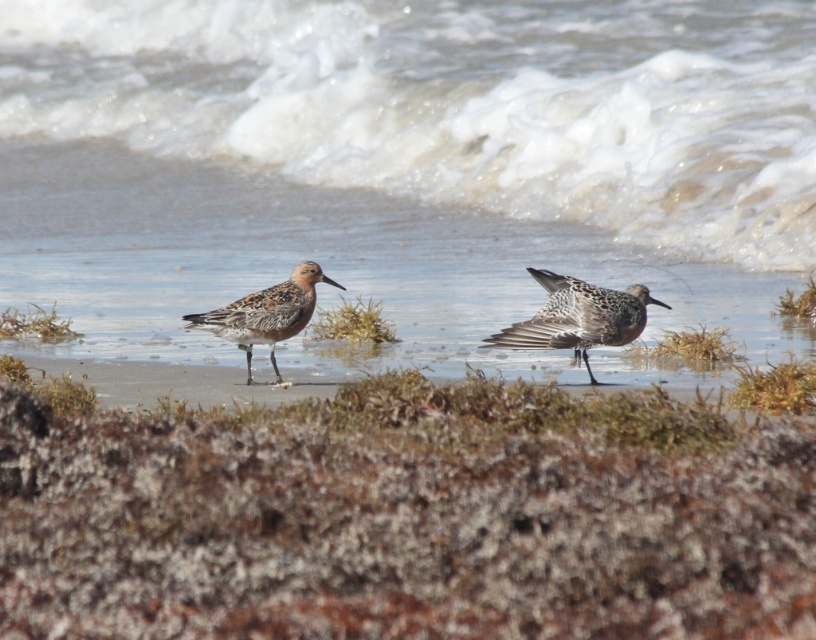
You are a birdwatcher standing on the shore observing the two birds. You notice the white frothy water at center and the brown speckled feathers at center. How far apart are these two features from each other?

The white frothy water at center is 6.60 meters from the brown speckled feathers at center.

You are a birdwatcher observing the two birds in the scene. You notice that one has brown speckled feathers at center and the other is a brown speckled sandpiper at center. Which object is positioned lower in the image?

The brown speckled feathers at center is located below the brown speckled sandpiper at center, so it is positioned lower in the image.